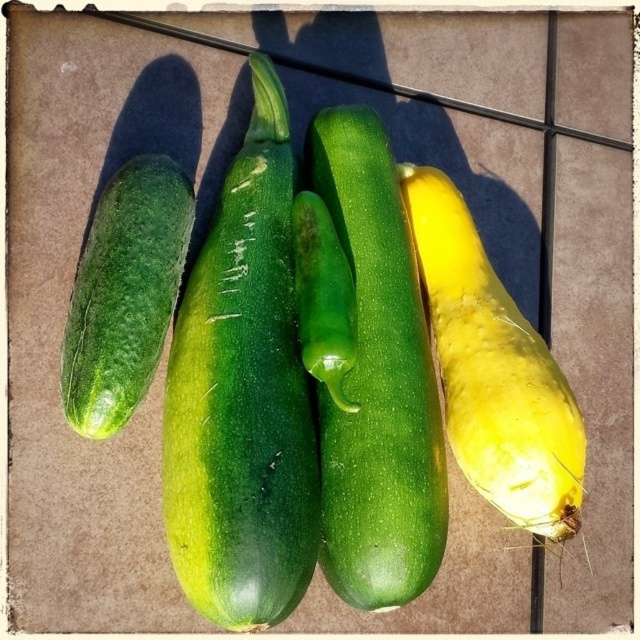
Question: Observing the image, what is the correct spatial positioning of green smooth cucumber at center in reference to green matte cucumber at left?

Choices:
 (A) left
 (B) right

Answer: (B)

Question: Which of the following is the closest to the observer?

Choices:
 (A) (355, 163)
 (B) (541, 445)
 (C) (324, 211)
 (D) (125, 241)

Answer: (B)

Question: Is yellow matte squash at right positioned behind green matte cucumber at left?

Choices:
 (A) no
 (B) yes

Answer: (B)

Question: Among these points, which one is nearest to the camera?

Choices:
 (A) (371, 397)
 (B) (310, 312)
 (C) (108, 346)

Answer: (C)

Question: Considering the relative positions of green matte cucumber at left and green glossy pepper at center in the image provided, where is green matte cucumber at left located with respect to green glossy pepper at center?

Choices:
 (A) below
 (B) above

Answer: (B)

Question: Which point appears closest to the camera in this image?

Choices:
 (A) (109, 358)
 (B) (458, 308)
 (C) (305, 300)
 (D) (211, 467)

Answer: (D)